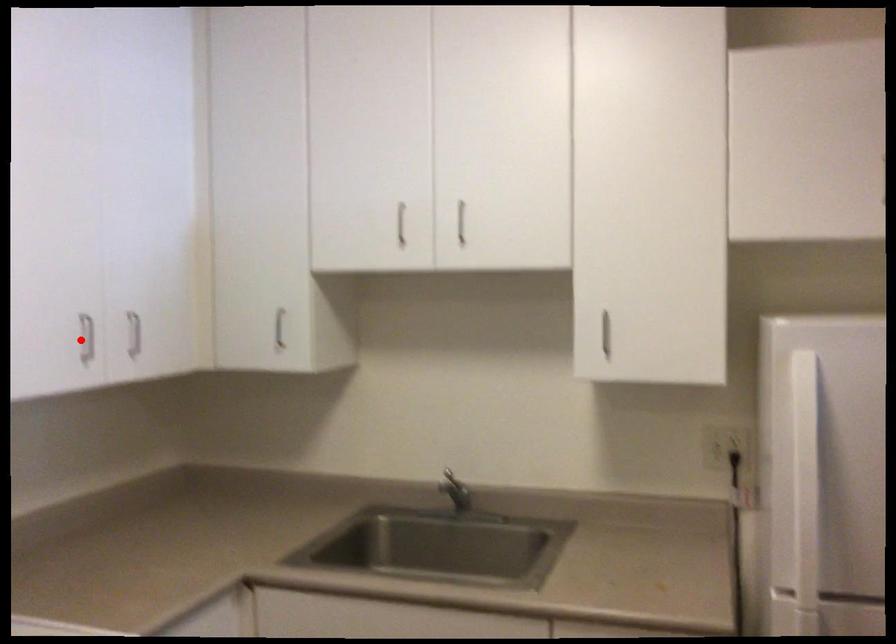
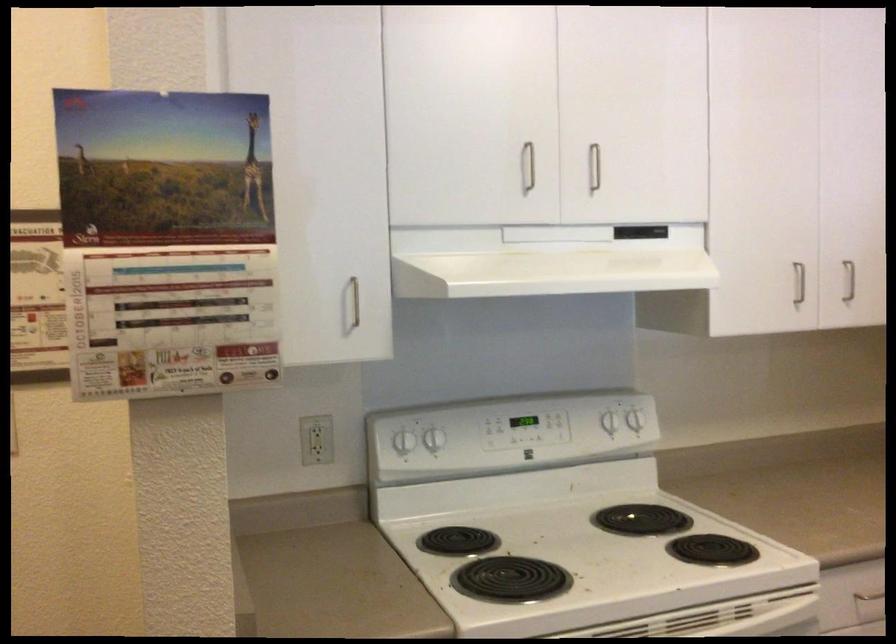
Where in the second image is the point corresponding to the highlighted location from the first image?

(798, 283)